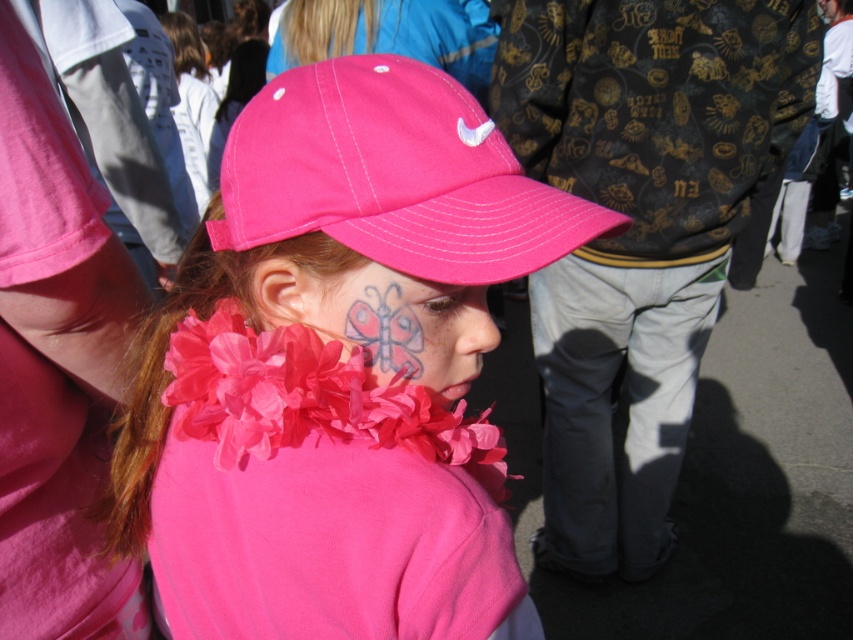
Question: Can you confirm if matte pink baseball cap at center is positioned above matte pink butterfly at center?

Choices:
 (A) yes
 (B) no

Answer: (A)

Question: Which point is farther to the camera?

Choices:
 (A) (490, 452)
 (B) (461, 577)
 (C) (390, 326)

Answer: (A)

Question: Which point is farther to the camera?

Choices:
 (A) matte pink cap at center
 (B) matte pink baseball cap at center
 (C) matte pink butterfly at center

Answer: (C)

Question: Among these points, which one is farthest from the camera?

Choices:
 (A) (509, 152)
 (B) (186, 384)
 (C) (416, 337)

Answer: (B)

Question: Observing the image, what is the correct spatial positioning of matte pink cap at center in reference to fluffy fabric flower at center?

Choices:
 (A) below
 (B) above

Answer: (A)

Question: Does matte pink baseball cap at center appear under fluffy fabric flower at center?

Choices:
 (A) yes
 (B) no

Answer: (B)